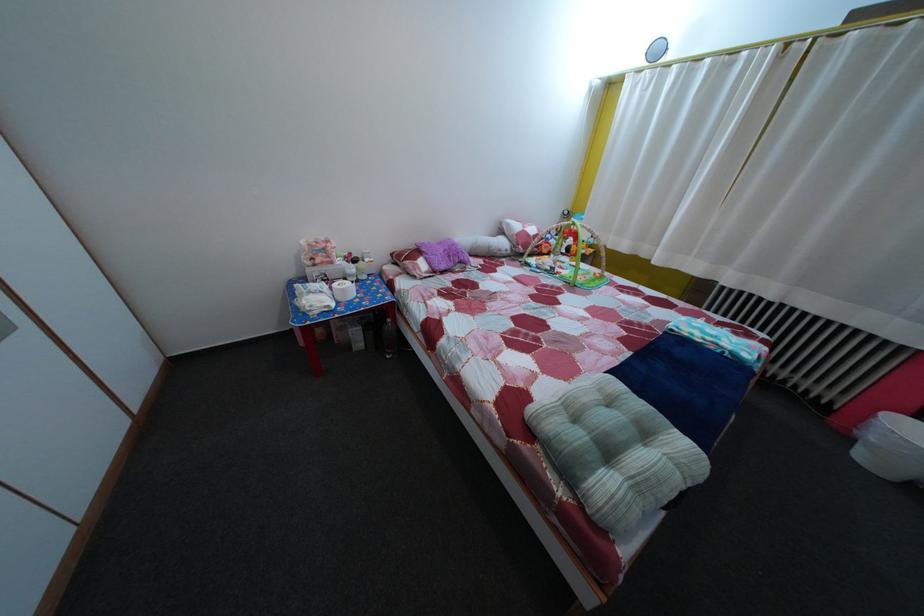
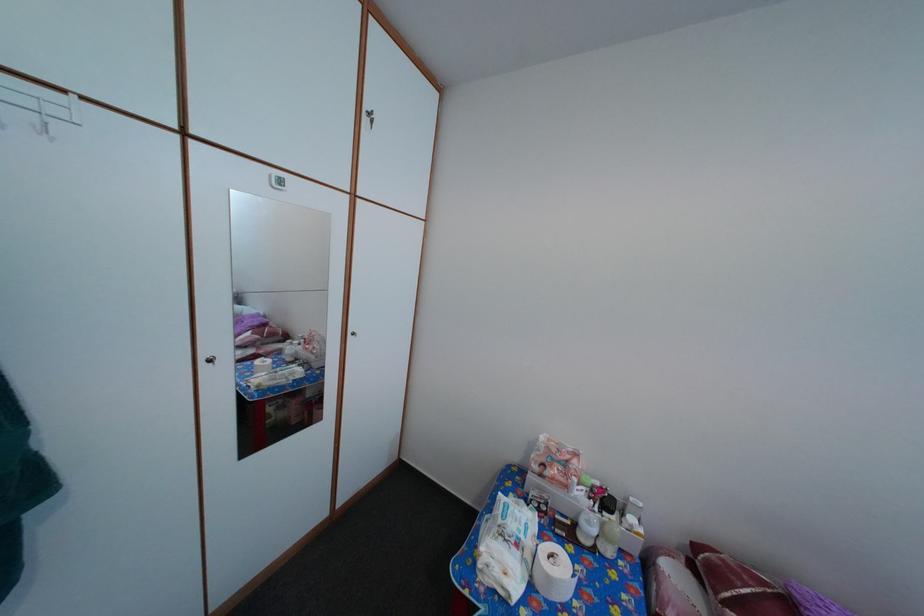
In the second image, find the point that corresponds to point 313,321 in the first image.

(484, 572)